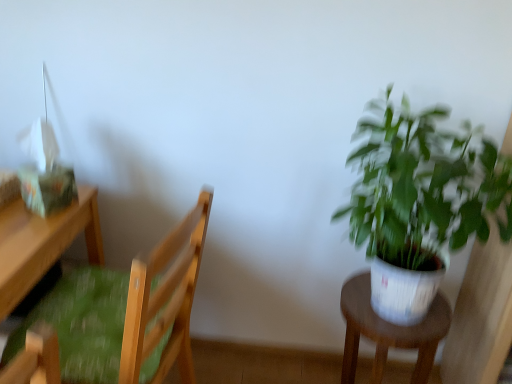
What is the approximate height of wooden chair with green cushion at left?

It is 84.84 centimeters.

Measure the distance between point (378, 318) and camera.

Point (378, 318) is 3.92 feet from camera.

The height and width of the screenshot is (384, 512). What are the coordinates of `green leafy plant at right` in the screenshot? It's located at (420, 202).

Locate an element on the screen. This screenshot has width=512, height=384. wooden chair with green cushion at left is located at coordinates (165, 299).

Considering the points (20, 269) and (434, 342), which point is in front, point (20, 269) or point (434, 342)?

Point (20, 269)

From the image's perspective, which object appears higher, wooden desk at left or white plastic stool at right?

wooden desk at left.

Is wooden desk at left positioned far away from white plastic stool at right?

No, wooden desk at left is not far away from white plastic stool at right.

Considering the positions of objects wooden chair with green cushion at left and white plastic stool at right in the image provided, who is in front, wooden chair with green cushion at left or white plastic stool at right?

A: wooden chair with green cushion at left is in front.

Find the location of a particular element. Image resolution: width=512 pixels, height=384 pixels. chair in front of the white plastic stool at right is located at coordinates (165, 299).

From the picture: From a real-world perspective, which object stands above the other?

From a 3D spatial view, wooden chair with green cushion at left is above.

Does wooden chair with green cushion at left touch white plastic stool at right?

No, wooden chair with green cushion at left is not touching white plastic stool at right.

Can you confirm if wooden desk at left is wider than wooden chair with green cushion at left?

Yes, wooden desk at left is wider than wooden chair with green cushion at left.

Which of these two, wooden desk at left or wooden chair with green cushion at left, is bigger?

With larger size is wooden desk at left.

How many degrees apart are the facing directions of wooden desk at left and wooden chair with green cushion at left?

169 degrees.

Are wooden desk at left and wooden chair with green cushion at left beside each other?

No, wooden desk at left is not beside wooden chair with green cushion at left.

Can green leafy plant at right be found inside wooden chair with green cushion at left?

No, green leafy plant at right is not a part of wooden chair with green cushion at left.

What are the coordinates of `chair below the green leafy plant at right (from the image's perspective)` in the screenshot? It's located at (165, 299).

Considering the relative sizes of wooden chair with green cushion at left and green leafy plant at right in the image provided, is wooden chair with green cushion at left smaller than green leafy plant at right?

Correct, wooden chair with green cushion at left occupies less space than green leafy plant at right.

Could you tell me if wooden chair with green cushion at left is facing green leafy plant at right?

No, wooden chair with green cushion at left is not turned towards green leafy plant at right.

From a real-world perspective, is wooden desk at left located beneath green leafy plant at right?

Correct, in the physical world, wooden desk at left is lower than green leafy plant at right.

Considering the points (2, 232) and (495, 169), which point is in front, point (2, 232) or point (495, 169)?

Point (495, 169)

Consider the image. Considering the relative sizes of wooden desk at left and green leafy plant at right in the image provided, is wooden desk at left thinner than green leafy plant at right?

No.

From the picture: Is wooden desk at left touching green leafy plant at right?

No, wooden desk at left is not next to green leafy plant at right.

From a real-world perspective, which object rests below the other?

wooden desk at left is physically lower.

What's the angular difference between green leafy plant at right and wooden desk at left's facing directions?

The facing directions of green leafy plant at right and wooden desk at left are 90.4 degrees apart.

Considering the sizes of objects green leafy plant at right and wooden desk at left in the image provided, who is bigger, green leafy plant at right or wooden desk at left?

Bigger between the two is wooden desk at left.

Does green leafy plant at right have a greater height compared to wooden desk at left?

In fact, green leafy plant at right may be shorter than wooden desk at left.

Is white plastic stool at right positioned with its back to wooden chair with green cushion at left?

No, white plastic stool at right is not facing away from wooden chair with green cushion at left.

In terms of height, does white plastic stool at right look taller or shorter compared to wooden chair with green cushion at left?

In the image, white plastic stool at right appears to be shorter than wooden chair with green cushion at left.

Is white plastic stool at right bigger than wooden chair with green cushion at left?

Actually, white plastic stool at right might be smaller than wooden chair with green cushion at left.

Is white plastic stool at right closer to the viewer compared to wooden chair with green cushion at left?

That is False.

Locate an element on the screen. The image size is (512, 384). stool below the wooden desk at left (from a real-world perspective) is located at coordinates (389, 332).

Find the location of `chair above the white plastic stool at right (from a real-world perspective)`. chair above the white plastic stool at right (from a real-world perspective) is located at coordinates (165, 299).

From the image, which object appears to be farther from white plastic stool at right, wooden desk at left or green leafy plant at right?

Among the two, wooden desk at left is located further to white plastic stool at right.

When comparing their distances from green leafy plant at right, does wooden chair with green cushion at left or wooden desk at left seem closer?

Among the two, wooden chair with green cushion at left is located nearer to green leafy plant at right.

Estimate the real-world distances between objects in this image. Which object is further from wooden desk at left, wooden chair with green cushion at left or green leafy plant at right?

Among the two, green leafy plant at right is located further to wooden desk at left.

Looking at the image, which one is located further to white plastic stool at right, green leafy plant at right or wooden chair with green cushion at left?

The object further to white plastic stool at right is wooden chair with green cushion at left.

Looking at the image, which one is located closer to wooden chair with green cushion at left, wooden desk at left or white plastic stool at right?

Among the two, wooden desk at left is located nearer to wooden chair with green cushion at left.

Based on their spatial positions, is wooden chair with green cushion at left or white plastic stool at right further from wooden desk at left?

Among the two, white plastic stool at right is located further to wooden desk at left.

Which object lies further to the anchor point wooden chair with green cushion at left, green leafy plant at right or white plastic stool at right?

white plastic stool at right.

Considering their positions, is wooden chair with green cushion at left positioned further to white plastic stool at right than wooden desk at left?

wooden desk at left.

Find the location of `stool between wooden chair with green cushion at left and green leafy plant at right from left to right`. stool between wooden chair with green cushion at left and green leafy plant at right from left to right is located at coordinates (389, 332).

At what (x,y) coordinates should I click in order to perform the action: click on chair between wooden desk at left and white plastic stool at right. Please return your answer as a coordinate pair (x, y). The image size is (512, 384). Looking at the image, I should click on (165, 299).

Where is `stool situated between wooden desk at left and green leafy plant at right from left to right`? stool situated between wooden desk at left and green leafy plant at right from left to right is located at coordinates (389, 332).

Identify the location of chair between wooden desk at left and green leafy plant at right in the horizontal direction. Image resolution: width=512 pixels, height=384 pixels. (165, 299).